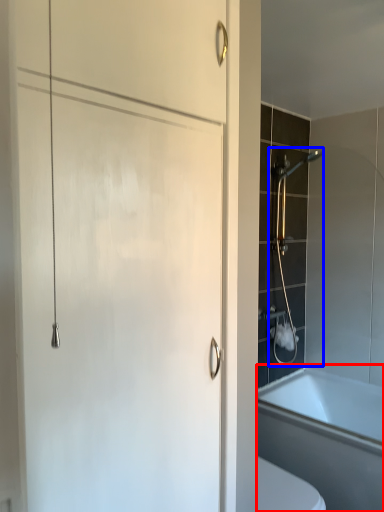
Question: Among these objects, which one is nearest to the camera, bathtub (highlighted by a red box) or shower (highlighted by a blue box)?

Choices:
 (A) bathtub
 (B) shower

Answer: (A)